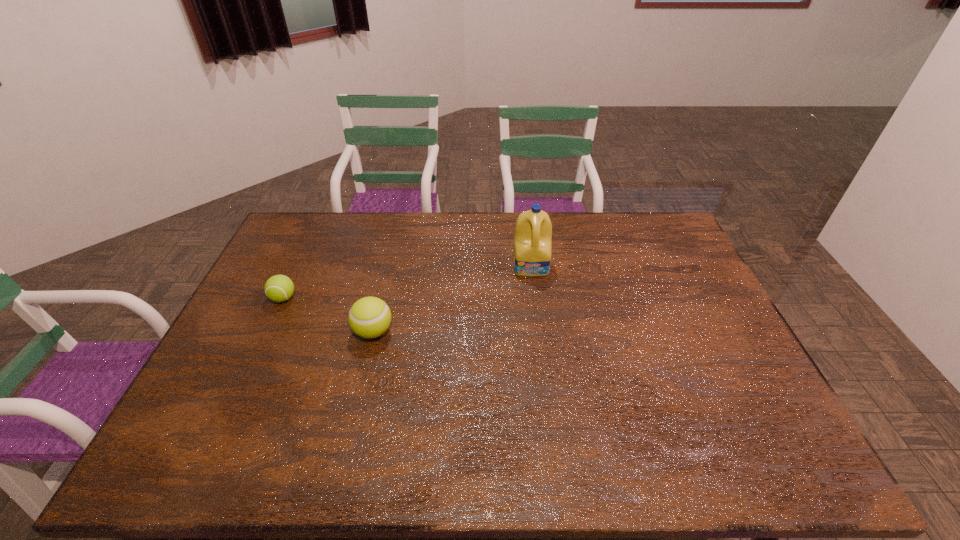
In the image, there is a desktop. Find the location of `vacant space at the far edge`. vacant space at the far edge is located at coordinates (465, 248).

Identify the location of vacant space at the left edge of the desktop. The width and height of the screenshot is (960, 540). (251, 396).

Image resolution: width=960 pixels, height=540 pixels. What are the coordinates of `free spot at the right edge of the desktop` in the screenshot? It's located at (738, 394).

This screenshot has height=540, width=960. In order to click on free space at the far left corner in this screenshot , I will do `click(318, 225)`.

This screenshot has width=960, height=540. I want to click on vacant space at the far right corner of the desktop, so click(x=646, y=226).

Where is `empty space between the second object from right to left and the detergent`? The width and height of the screenshot is (960, 540). empty space between the second object from right to left and the detergent is located at coordinates (452, 299).

The height and width of the screenshot is (540, 960). Find the location of `vacant space that's between the farther tennis ball and the nearest object`. vacant space that's between the farther tennis ball and the nearest object is located at coordinates (328, 315).

Identify the location of free space that is in between the taller tennis ball and the tallest object. The height and width of the screenshot is (540, 960). (452, 299).

The image size is (960, 540). Find the location of `free spot between the detergent and the nearer tennis ball`. free spot between the detergent and the nearer tennis ball is located at coordinates (452, 299).

The width and height of the screenshot is (960, 540). What are the coordinates of `vacant space in between the shorter tennis ball and the detergent` in the screenshot? It's located at (407, 282).